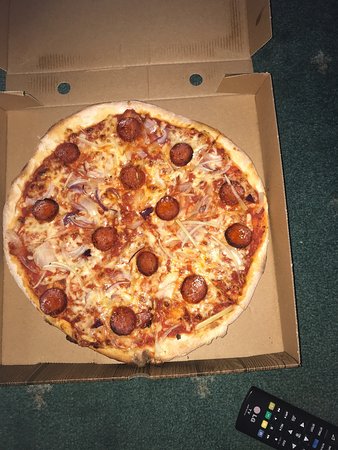
The height and width of the screenshot is (450, 338). Identify the location of cardboard box. (252, 351).